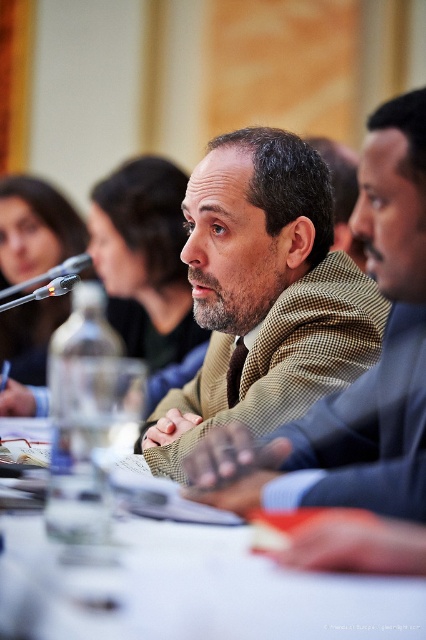
Question: Which of the following is the closest to the observer?

Choices:
 (A) white glossy table at center
 (B) green checkered blazer at center

Answer: (A)

Question: Which point is farther from the camera taking this photo?

Choices:
 (A) (256, 278)
 (B) (370, 621)

Answer: (A)

Question: Can you confirm if green checkered blazer at center is smaller than white glossy table at center?

Choices:
 (A) no
 (B) yes

Answer: (A)

Question: Does green checkered blazer at center appear on the right side of white glossy table at center?

Choices:
 (A) yes
 (B) no

Answer: (A)

Question: Observing the image, what is the correct spatial positioning of green checkered blazer at center in reference to white glossy table at center?

Choices:
 (A) right
 (B) left

Answer: (A)